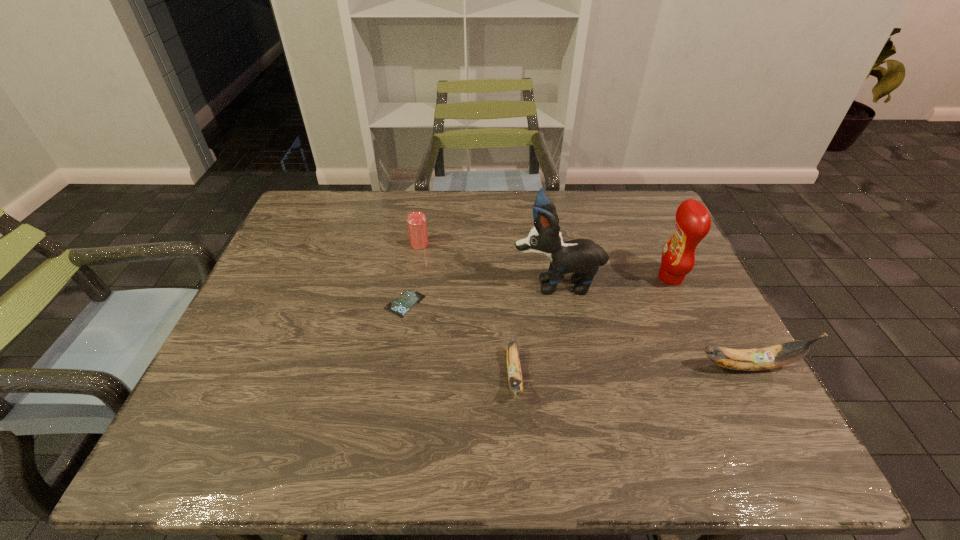
Identify the location of the left banana. (514, 372).

What are the coordinates of `the second shortest object` in the screenshot? It's located at (514, 372).

Where is `the fourth shortest object`? This screenshot has width=960, height=540. the fourth shortest object is located at coordinates (783, 354).

Where is `the right banana`? the right banana is located at coordinates (783, 354).

I want to click on beer can, so click(417, 227).

Where is `the third shortest object`? the third shortest object is located at coordinates (417, 227).

Locate an element on the screen. This screenshot has width=960, height=540. the second tallest object is located at coordinates (693, 222).

You are a GUI agent. You are given a task and a screenshot of the screen. Output one action in this format:
    pyautogui.click(x=<x>, y=<y>)
    Task: Click on the puppy
    The width and height of the screenshot is (960, 540).
    Given the screenshot: What is the action you would take?
    pyautogui.click(x=582, y=257)

Locate an element on the screen. This screenshot has height=540, width=960. the shortest object is located at coordinates (406, 300).

Where is `free location located 0.340m on the front of the beer can`? The width and height of the screenshot is (960, 540). free location located 0.340m on the front of the beer can is located at coordinates (404, 342).